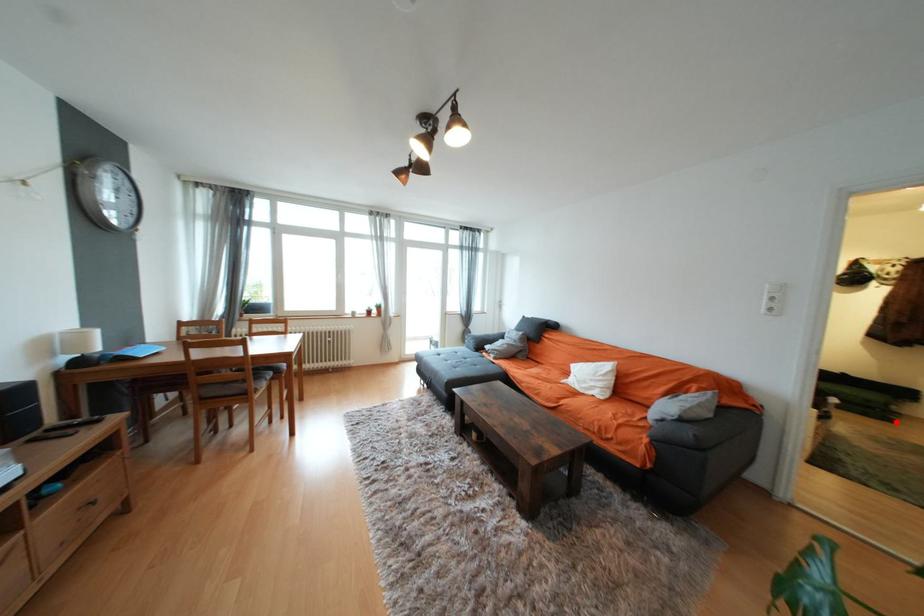
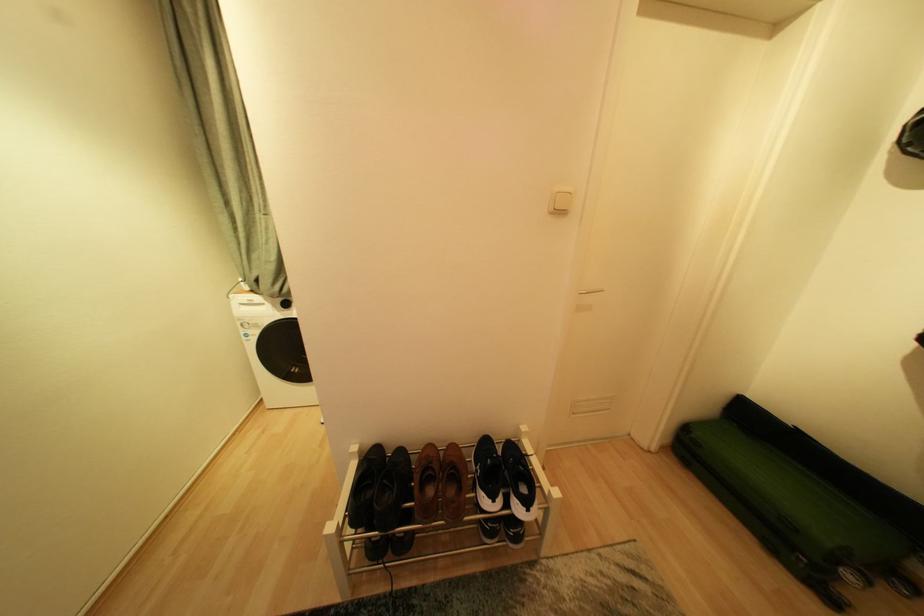
Question: A red point is marked in image1. In image2, is the corresponding 3D point closer to the camera or farther? Reply with the corresponding letter.

Choices:
 (A) The corresponding 3D point is closer.
 (B) The corresponding 3D point is farther.

Answer: (A)